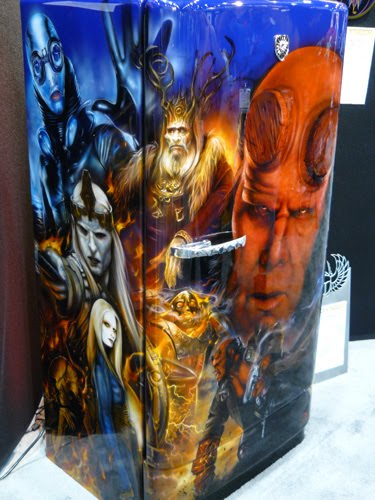
The image size is (375, 500). In order to click on glass in this screenshot , I will do click(x=327, y=22).